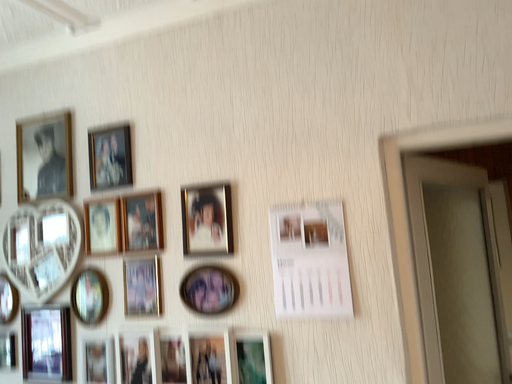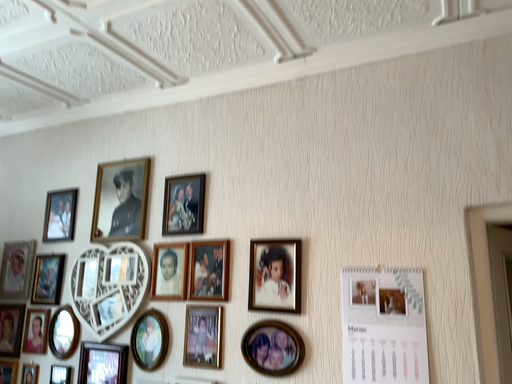
Question: How did the camera likely rotate when shooting the video?

Choices:
 (A) rotated upward
 (B) rotated downward

Answer: (A)